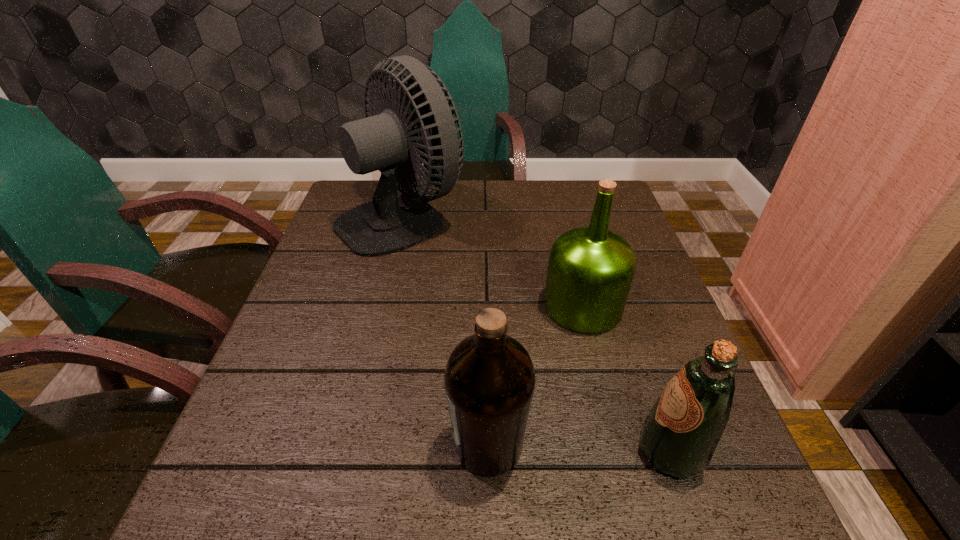
Where is `the tallest object`? The image size is (960, 540). the tallest object is located at coordinates (389, 223).

Locate an element on the screen. Image resolution: width=960 pixels, height=540 pixels. fan is located at coordinates (389, 223).

Find the location of a particular element. The image size is (960, 540). the farthest olive oil is located at coordinates (590, 271).

Where is `the leftmost olive oil`? This screenshot has width=960, height=540. the leftmost olive oil is located at coordinates (489, 379).

Image resolution: width=960 pixels, height=540 pixels. Find the location of `the shortest object`. the shortest object is located at coordinates (679, 436).

You are a GUI agent. You are given a task and a screenshot of the screen. Output one action in this format:
    pyautogui.click(x=<x>, y=<y>)
    Task: Click on the free spot located 0.380m in front of the farthest object to direct airflow
    Image resolution: width=960 pixels, height=540 pixels.
    Given the screenshot: What is the action you would take?
    pyautogui.click(x=605, y=217)

Locate an element on the screen. The image size is (960, 540). free space located on the left of the second farthest object is located at coordinates (428, 306).

Locate an element on the screen. The height and width of the screenshot is (540, 960). free point located 0.160m on the label of the leftmost olive oil is located at coordinates (351, 444).

I want to click on vacant space situated on the label of the leftmost olive oil, so click(x=351, y=444).

Locate an element on the screen. This screenshot has height=540, width=960. vacant space located 0.200m on the label of the leftmost olive oil is located at coordinates (326, 444).